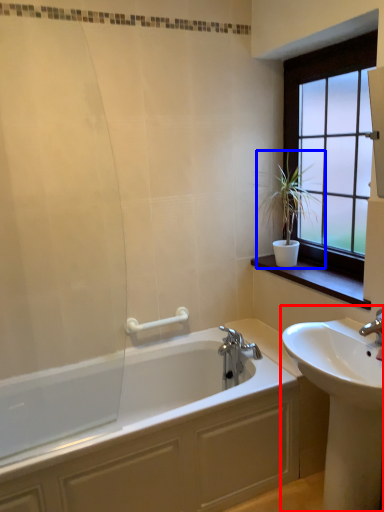
Question: Which of the following is the closest to the observer, sink (highlighted by a red box) or houseplant (highlighted by a blue box)?

Choices:
 (A) sink
 (B) houseplant

Answer: (A)